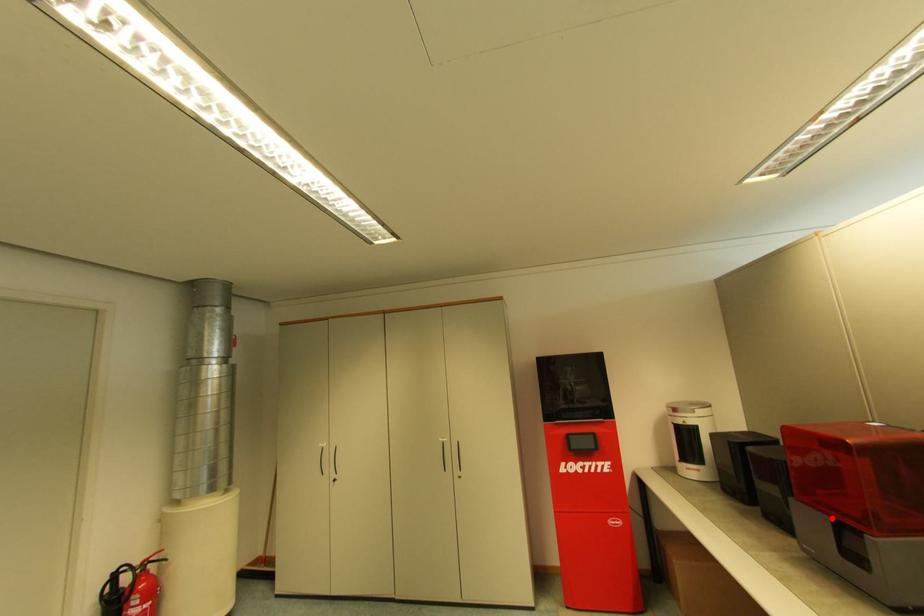
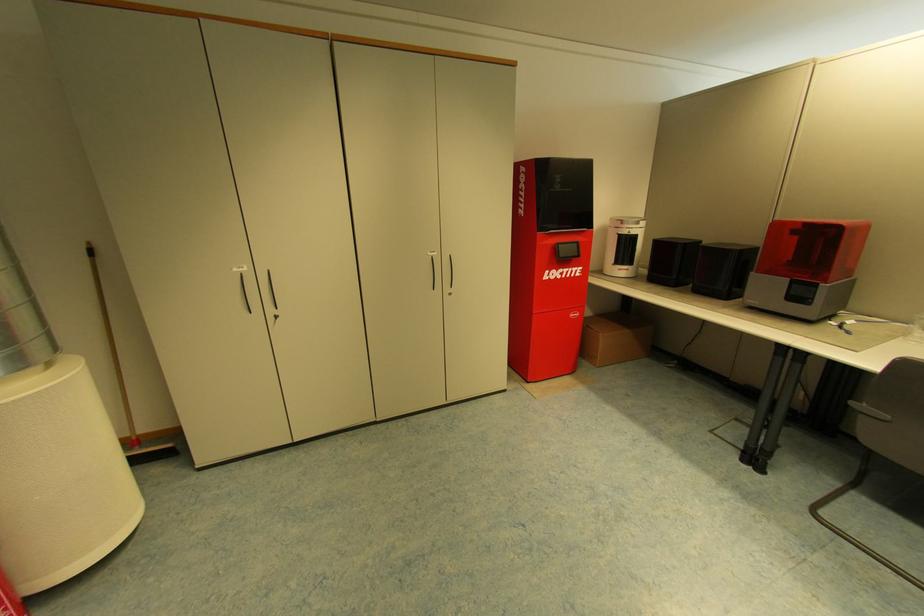
Question: A red point is marked in image1. In image2, is the corresponding 3D point closer to the camera or farther? Reply with the corresponding letter.

Choices:
 (A) The corresponding 3D point is closer.
 (B) The corresponding 3D point is farther.

Answer: (B)